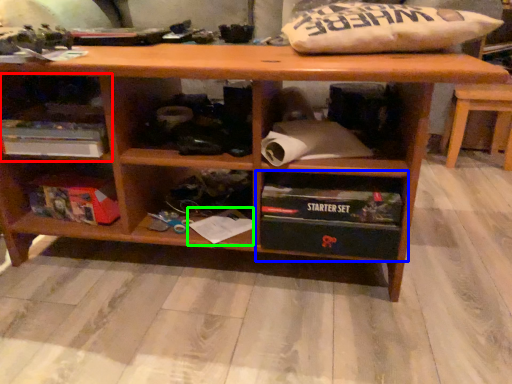
Question: Based on their relative distances, which object is farther from shelf (highlighted by a red box)? Choose from shelf (highlighted by a blue box) and book (highlighted by a green box).

Choices:
 (A) shelf
 (B) book

Answer: (A)